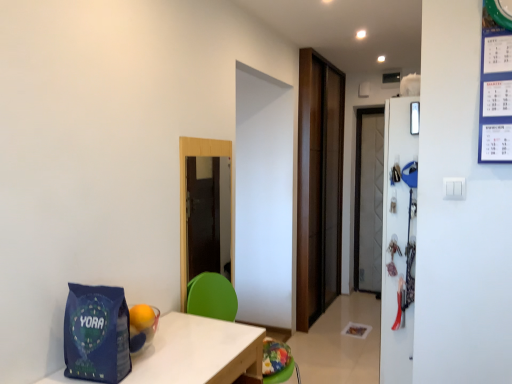
Question: Can you confirm if white wood table at lower left is shorter than transparent wooden door at center?

Choices:
 (A) yes
 (B) no

Answer: (A)

Question: Can we say white wood table at lower left lies outside transparent wooden door at center?

Choices:
 (A) yes
 (B) no

Answer: (A)

Question: Could you tell me if white wood table at lower left is facing transparent wooden door at center?

Choices:
 (A) no
 (B) yes

Answer: (A)

Question: From the image's perspective, is white wood table at lower left located beneath transparent wooden door at center?

Choices:
 (A) no
 (B) yes

Answer: (B)

Question: Is white wood table at lower left smaller than transparent wooden door at center?

Choices:
 (A) yes
 (B) no

Answer: (B)

Question: Does white wood table at lower left have a larger size compared to transparent wooden door at center?

Choices:
 (A) no
 (B) yes

Answer: (B)

Question: From the image's perspective, is blue matte gift bag at lower left on top of white glossy refrigerator at right?

Choices:
 (A) yes
 (B) no

Answer: (B)

Question: Is blue matte gift bag at lower left looking in the opposite direction of white glossy refrigerator at right?

Choices:
 (A) no
 (B) yes

Answer: (A)

Question: Could you tell me if blue matte gift bag at lower left is turned towards white glossy refrigerator at right?

Choices:
 (A) no
 (B) yes

Answer: (A)

Question: Is blue matte gift bag at lower left bigger than white glossy refrigerator at right?

Choices:
 (A) yes
 (B) no

Answer: (B)

Question: Is blue matte gift bag at lower left far away from white glossy refrigerator at right?

Choices:
 (A) yes
 (B) no

Answer: (A)

Question: Is the position of blue matte gift bag at lower left more distant than that of white glossy refrigerator at right?

Choices:
 (A) yes
 (B) no

Answer: (B)

Question: Would you consider brown wood door at center to be distant from green plastic chair at center?

Choices:
 (A) no
 (B) yes

Answer: (B)